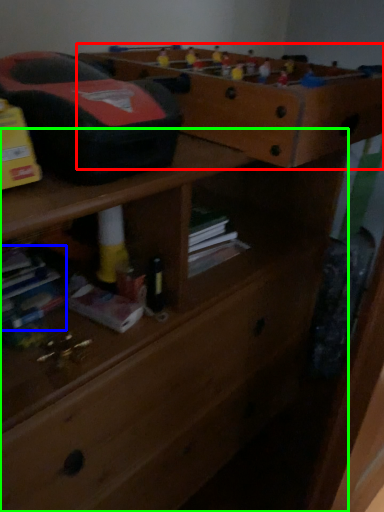
Question: Which object is positioned closest to shelf (highlighted by a red box)? Select from book (highlighted by a blue box) and chest of drawers (highlighted by a green box).

Choices:
 (A) book
 (B) chest of drawers

Answer: (B)